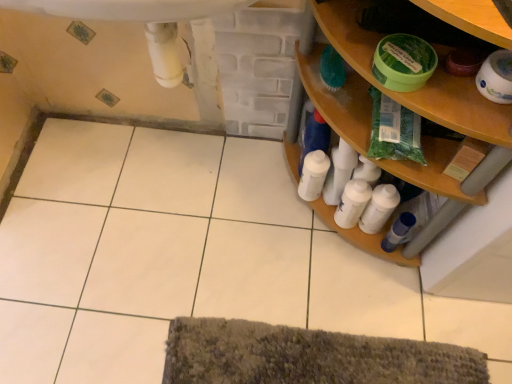
Where is `vacant area situated to the left side of white glossy bottle at lower right, the 3th toiletry viewed from the right`? The width and height of the screenshot is (512, 384). vacant area situated to the left side of white glossy bottle at lower right, the 3th toiletry viewed from the right is located at coordinates (253, 198).